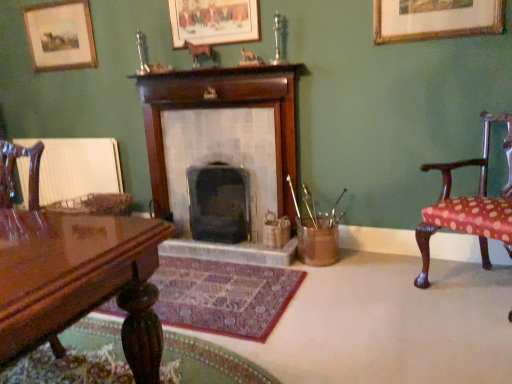
Question: Is wooden fireplace at center, marked as the 1th fireplace in a left-to-right arrangement, taller than matte wooden picture frame at upper left, the third picture frame when ordered from front to back?

Choices:
 (A) no
 (B) yes

Answer: (B)

Question: Can you confirm if wooden fireplace at center, marked as the 1th fireplace in a left-to-right arrangement, is bigger than matte wooden picture frame at upper left, which appears as the third picture frame when viewed from the right?

Choices:
 (A) yes
 (B) no

Answer: (A)

Question: Is wooden fireplace at center, the 2th fireplace in the right-to-left sequence, at the right side of matte wooden picture frame at upper left, which appears as the third picture frame when viewed from the right?

Choices:
 (A) yes
 (B) no

Answer: (A)

Question: Can you confirm if wooden fireplace at center, marked as the 1th fireplace in a left-to-right arrangement, is shorter than matte wooden picture frame at upper left, which is counted as the first picture frame, starting from the left?

Choices:
 (A) yes
 (B) no

Answer: (B)

Question: Does wooden fireplace at center, marked as the 1th fireplace in a left-to-right arrangement, have a smaller size compared to matte wooden picture frame at upper left, which is counted as the first picture frame, starting from the left?

Choices:
 (A) yes
 (B) no

Answer: (B)

Question: Is point (467, 21) closer or farther from the camera than point (36, 16)?

Choices:
 (A) farther
 (B) closer

Answer: (B)

Question: In the image, is gold-framed picture at upper right, arranged as the first picture frame when viewed from the front, positioned in front of or behind matte wooden picture frame at upper left, which is counted as the first picture frame, starting from the left?

Choices:
 (A) behind
 (B) front

Answer: (B)

Question: From the image's perspective, is gold-framed picture at upper right, arranged as the first picture frame when viewed from the front, above or below matte wooden picture frame at upper left, the third picture frame when ordered from front to back?

Choices:
 (A) below
 (B) above

Answer: (A)

Question: Which is correct: gold-framed picture at upper right, arranged as the first picture frame when viewed from the front, is inside matte wooden picture frame at upper left, which is counted as the first picture frame, starting from the left, or outside of it?

Choices:
 (A) outside
 (B) inside

Answer: (A)

Question: From a real-world perspective, is polka dot fabric chair at right, the first chair viewed from the right, above or below matte wooden picture frame at upper left, which is counted as the first picture frame, starting from the left?

Choices:
 (A) above
 (B) below

Answer: (B)

Question: Does point (506, 240) appear closer or farther from the camera than point (89, 28)?

Choices:
 (A) closer
 (B) farther

Answer: (A)

Question: Is polka dot fabric chair at right, the first chair viewed from the right, taller or shorter than matte wooden picture frame at upper left, which appears as the third picture frame when viewed from the right?

Choices:
 (A) short
 (B) tall

Answer: (B)

Question: From the image's perspective, is polka dot fabric chair at right, which is the second chair in left-to-right order, above or below matte wooden picture frame at upper left, the third picture frame when ordered from front to back?

Choices:
 (A) below
 (B) above

Answer: (A)

Question: Looking at the image, does wooden fireplace at center, marked as the 1th fireplace in a left-to-right arrangement, seem bigger or smaller compared to matte wooden picture frame at upper left, the third picture frame when ordered from front to back?

Choices:
 (A) small
 (B) big

Answer: (B)

Question: From a real-world perspective, is wooden fireplace at center, marked as the 1th fireplace in a left-to-right arrangement, above or below matte wooden picture frame at upper left, which is counted as the first picture frame, starting from the left?

Choices:
 (A) above
 (B) below

Answer: (B)